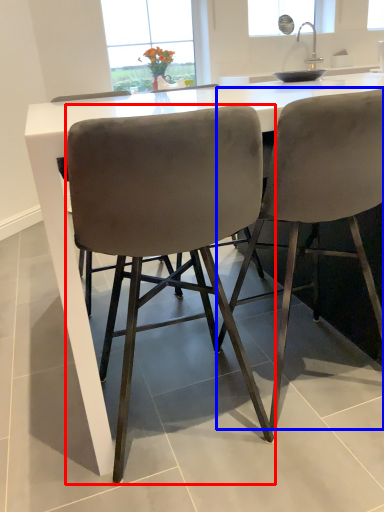
Question: Among these objects, which one is nearest to the camera, chair (highlighted by a red box) or chair (highlighted by a blue box)?

Choices:
 (A) chair
 (B) chair

Answer: (A)